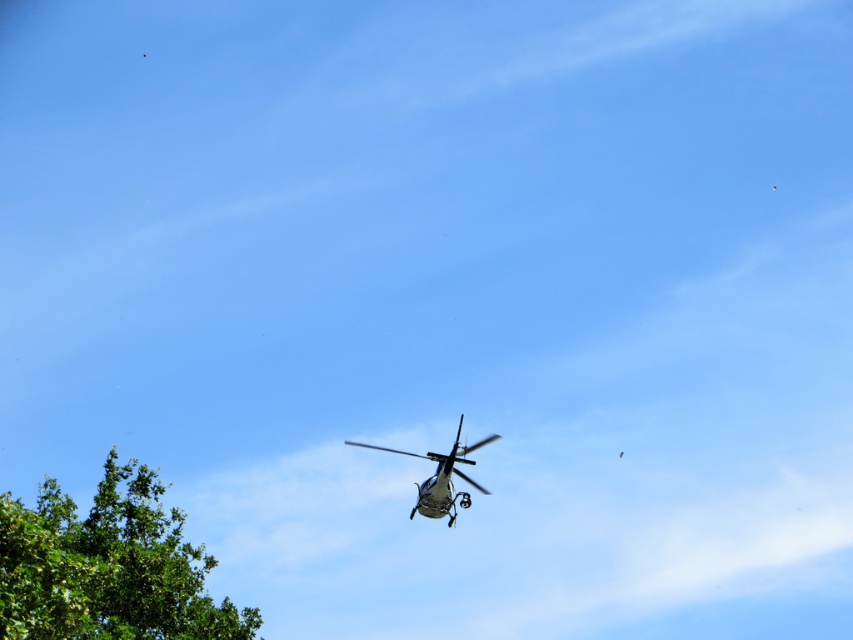
Question: Among these points, which one is nearest to the camera?

Choices:
 (A) (155, 566)
 (B) (453, 442)

Answer: (B)

Question: Can you confirm if green leafy tree at lower left is bigger than metallic silver helicopter at center?

Choices:
 (A) yes
 (B) no

Answer: (A)

Question: Which point appears farthest from the camera in this image?

Choices:
 (A) (469, 500)
 (B) (19, 563)

Answer: (A)

Question: In this image, where is green leafy tree at lower left located relative to metallic silver helicopter at center?

Choices:
 (A) above
 (B) below

Answer: (B)

Question: Is green leafy tree at lower left positioned at the back of metallic silver helicopter at center?

Choices:
 (A) no
 (B) yes

Answer: (B)